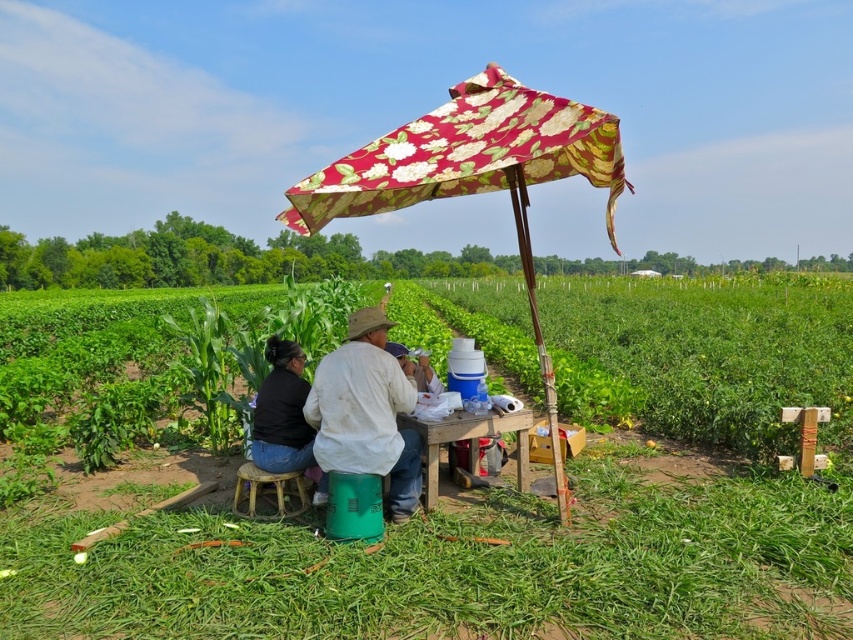
Question: In this image, where is green plastic stool at lower center located relative to black fabric shirt at lower left?

Choices:
 (A) left
 (B) right

Answer: (A)

Question: Based on their relative distances, which object is farther from the black fabric shirt at lower left?

Choices:
 (A) green plastic stool at lower center
 (B) brown woven stool at lower center
 (C) floral fabric umbrella at center
 (D) black cotton shirt at center

Answer: (A)

Question: Which object is farther from the camera taking this photo?

Choices:
 (A) black fabric shirt at lower left
 (B) brown woven stool at lower center
 (C) green plastic stool at lower center

Answer: (A)

Question: Does green plastic stool at lower center appear over black cotton shirt at center?

Choices:
 (A) no
 (B) yes

Answer: (A)

Question: Which point is farther to the camera?

Choices:
 (A) brown woven stool at lower center
 (B) wooden table at center
 (C) black cotton shirt at center
 (D) floral fabric umbrella at center

Answer: (B)

Question: Is black fabric shirt at lower left below wooden table at center?

Choices:
 (A) no
 (B) yes

Answer: (A)